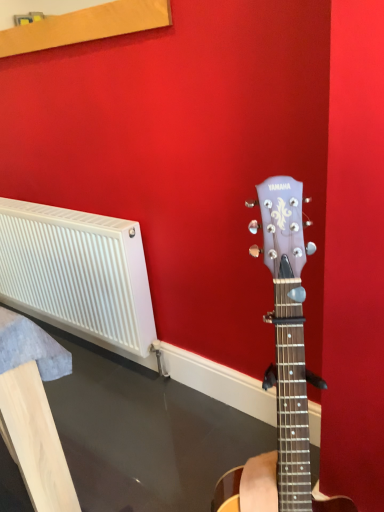
Question: Is point (46, 342) closer or farther from the camera than point (19, 271)?

Choices:
 (A) farther
 (B) closer

Answer: (B)

Question: Is white plastic radiator at left situated inside white plastic radiator at left or outside?

Choices:
 (A) outside
 (B) inside

Answer: (A)

Question: From the image's perspective, is white plastic radiator at left located above or below white plastic radiator at left?

Choices:
 (A) below
 (B) above

Answer: (A)

Question: Does point (140, 232) appear closer or farther from the camera than point (52, 368)?

Choices:
 (A) closer
 (B) farther

Answer: (B)

Question: Looking at their shapes, would you say white plastic radiator at left is wider or thinner than white plastic radiator at left?

Choices:
 (A) wide
 (B) thin

Answer: (B)

Question: Considering the positions of white plastic radiator at left and white plastic radiator at left in the image, is white plastic radiator at left taller or shorter than white plastic radiator at left?

Choices:
 (A) tall
 (B) short

Answer: (B)

Question: Is white plastic radiator at left situated inside white plastic radiator at left or outside?

Choices:
 (A) inside
 (B) outside

Answer: (B)